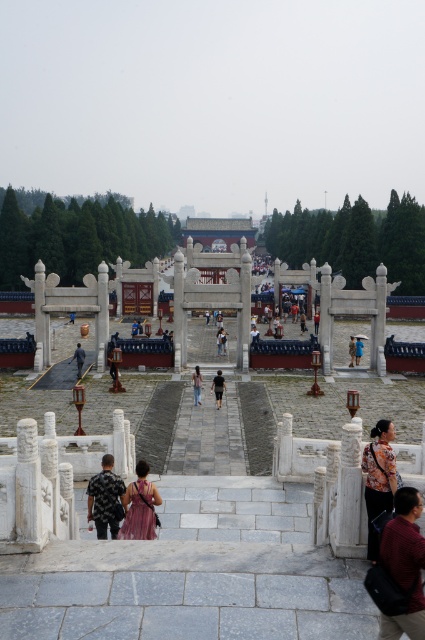
You are a photographer standing at the entrance of the stone pathway. You want to capture both the pink satin dress at center and the light blue fabric at center in a single shot without moving your position. Given that your camera has a maximum zoom range of 100 meters, can you fit both objects into your frame?

The distance between the pink satin dress at center and the light blue fabric at center is 47.65 meters. Since your camera can zoom up to 100 meters, which is more than the distance between them, you can fit both objects into your frame by adjusting the zoom accordingly.